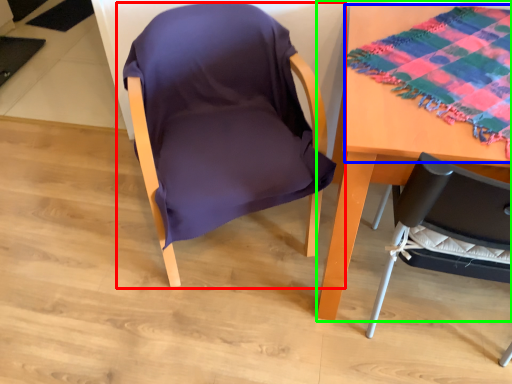
Question: Based on their relative distances, which object is farther from chair (highlighted by a red box)? Choose from blanket (highlighted by a blue box) and table (highlighted by a green box).

Choices:
 (A) blanket
 (B) table

Answer: (A)